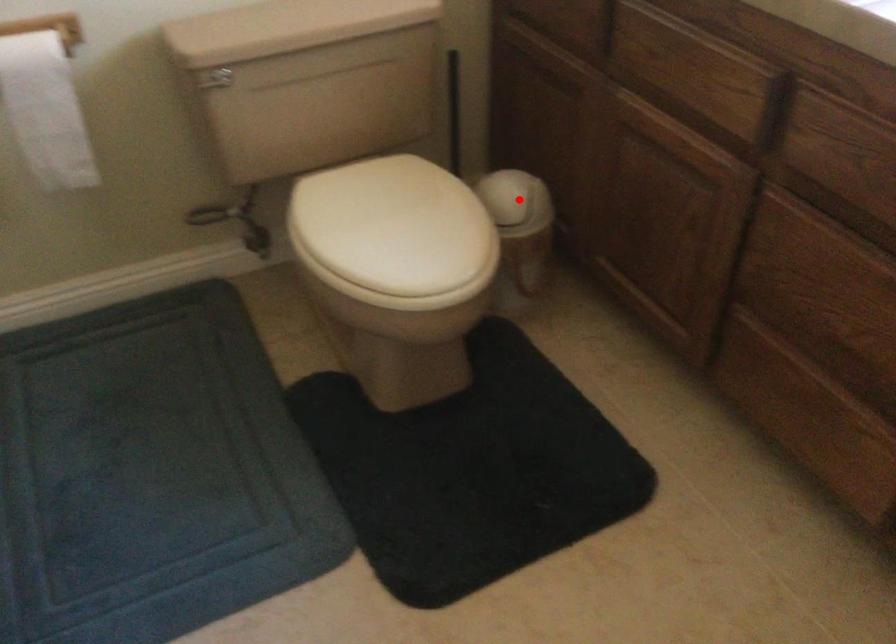
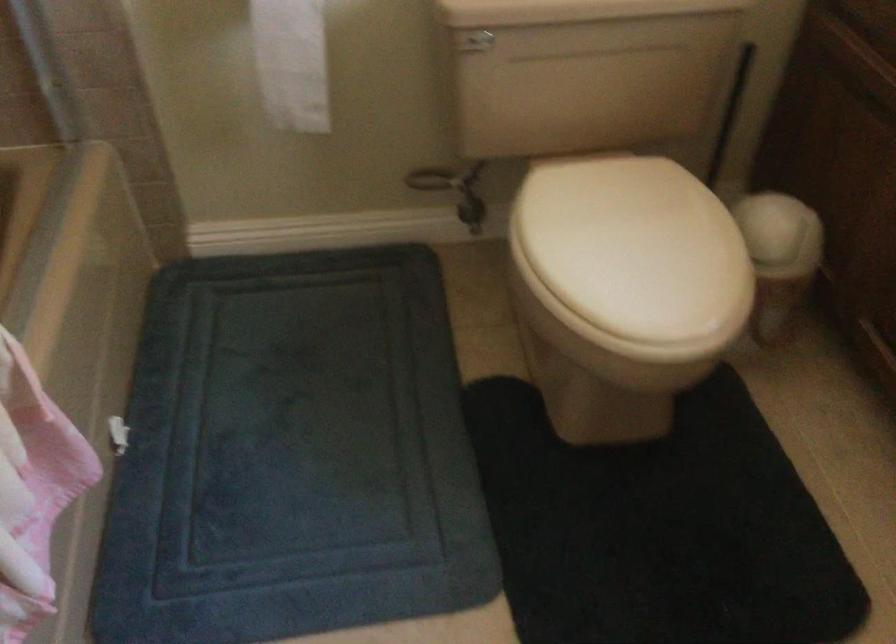
Where in the second image is the point corresponding to the highlighted location from the first image?

(780, 234)